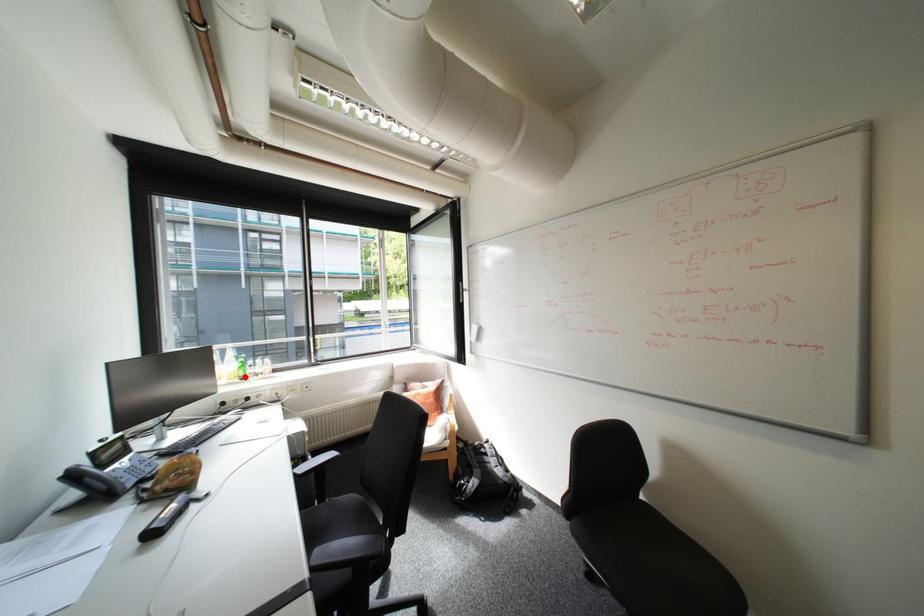
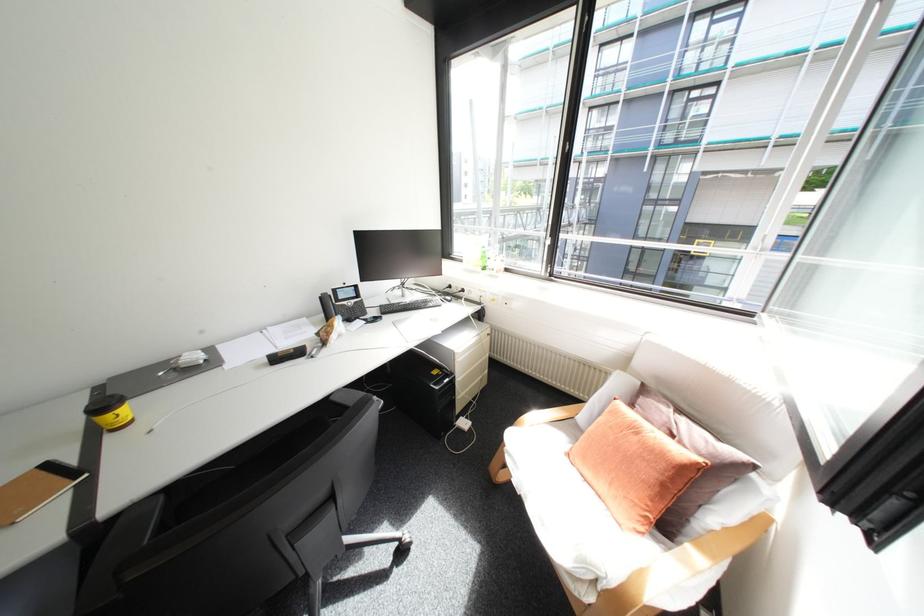
Locate, in the second image, the point that corresponds to the highlighted location in the first image.

(487, 265)